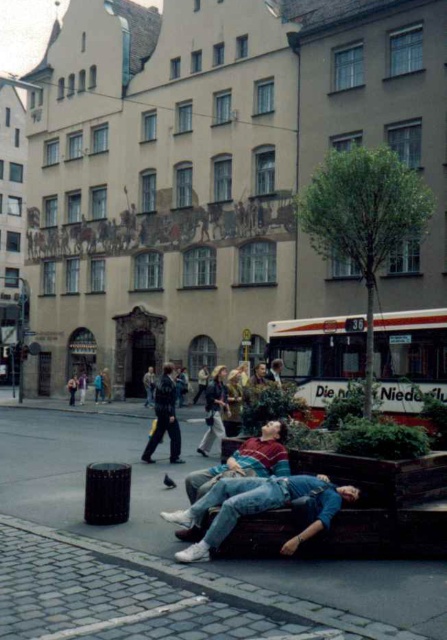
Question: Is brown wooden bench at lower center to the left of denim jacket at center from the viewer's perspective?

Choices:
 (A) no
 (B) yes

Answer: (A)

Question: Does denim jeans at lower center come in front of matte red shirt at center?

Choices:
 (A) no
 (B) yes

Answer: (B)

Question: Can you confirm if brown wooden bench at lower center is smaller than denim jacket at center?

Choices:
 (A) no
 (B) yes

Answer: (B)

Question: Which point is farther to the camera?

Choices:
 (A) (260, 499)
 (B) (161, 420)

Answer: (B)

Question: Which point is farther to the camera?

Choices:
 (A) (184, 525)
 (B) (165, 556)
 (C) (248, 460)

Answer: (C)

Question: Which of the following is the closest to the observer?

Choices:
 (A) denim jeans at lower center
 (B) matte red shirt at center
 (C) denim jacket at center
 (D) brown wooden bench at lower center

Answer: (D)